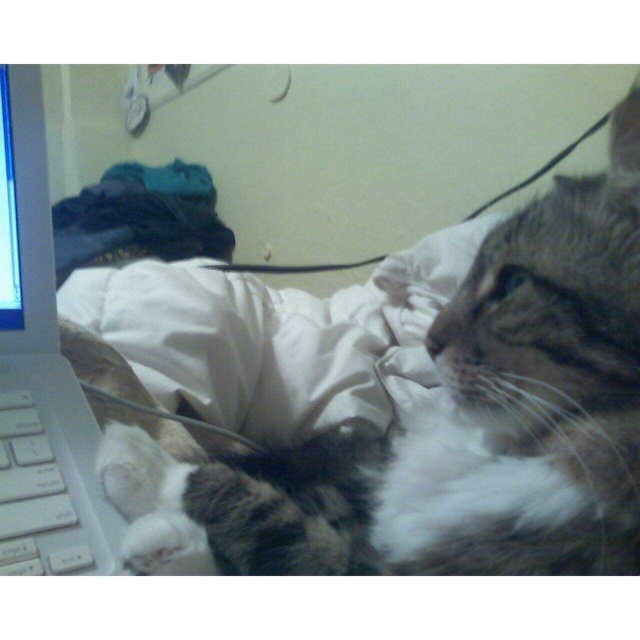
You are holding a small toy mouse and want to place it exactly at the point marked as point [428,516] in the image. If your hand is currently 40 centimeters away from the camera, will you need to move closer or farther to reach that point?

The distance of point [428,516] from the camera is 38.92 centimeters. Since your hand is currently 40 centimeters away, which is farther than the target point, you need to move closer to reach it.

You are trying to reach the tabby fur cat at center from the white plastic keyboard at lower left. Which direction should you move towards?

The tabby fur cat at center is to the right of the white plastic keyboard at lower left, so you should move towards the right to reach the cat.

Looking at this image, you are organizing a space for a pet and a computer. The tabby fur cat at center needs enough room to stretch out, and the white plastic keyboard at left must be placed where it won t be knocked over. Based on their sizes, which object should be placed in a more secure location?

The white plastic keyboard at left should be placed in a more secure location because the tabby fur cat at center is larger and more likely to accidentally knock over smaller items.